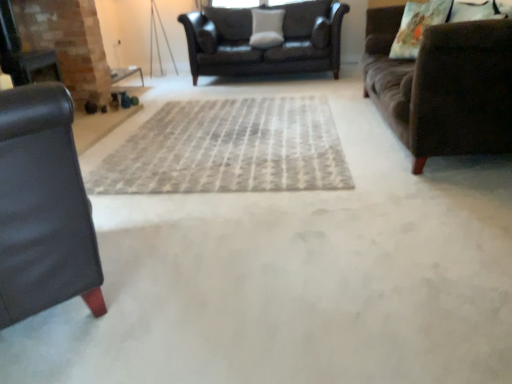
At what (x,y) coordinates should I click in order to perform the action: click on space that is in front of dark brown leather couch at center, the 1th studio couch from the back. Please return your answer as a coordinate pair (x, y). The width and height of the screenshot is (512, 384). Looking at the image, I should click on (252, 103).